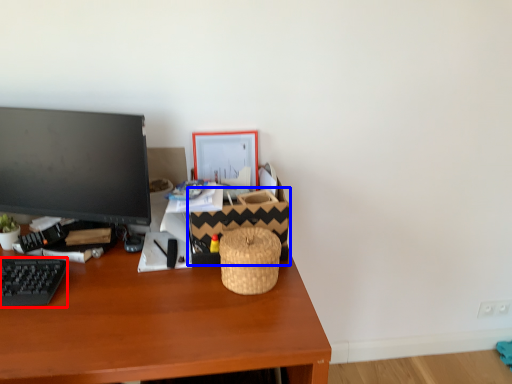
Question: Among these objects, which one is nearest to the camera, computer keyboard (highlighted by a red box) or basket (highlighted by a blue box)?

Choices:
 (A) computer keyboard
 (B) basket

Answer: (A)